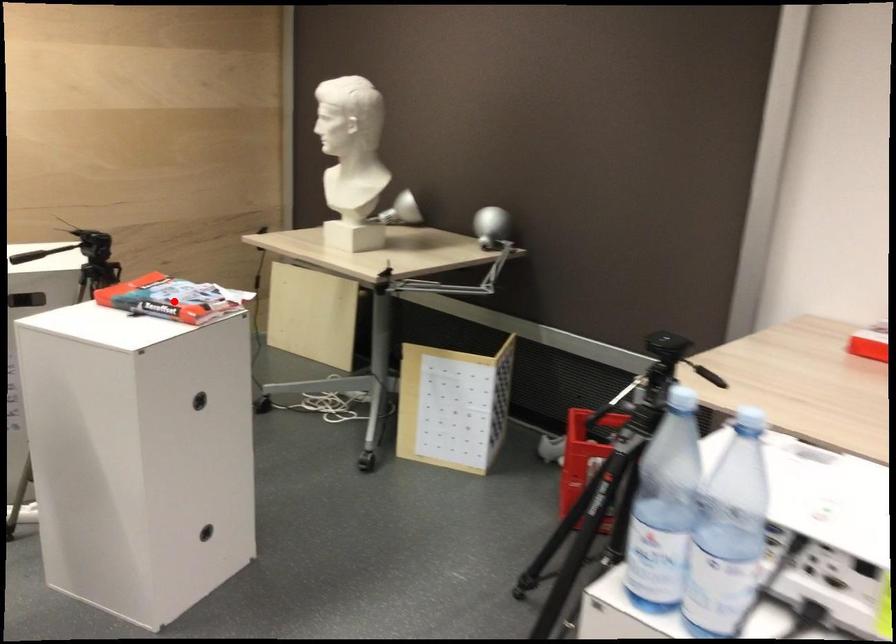
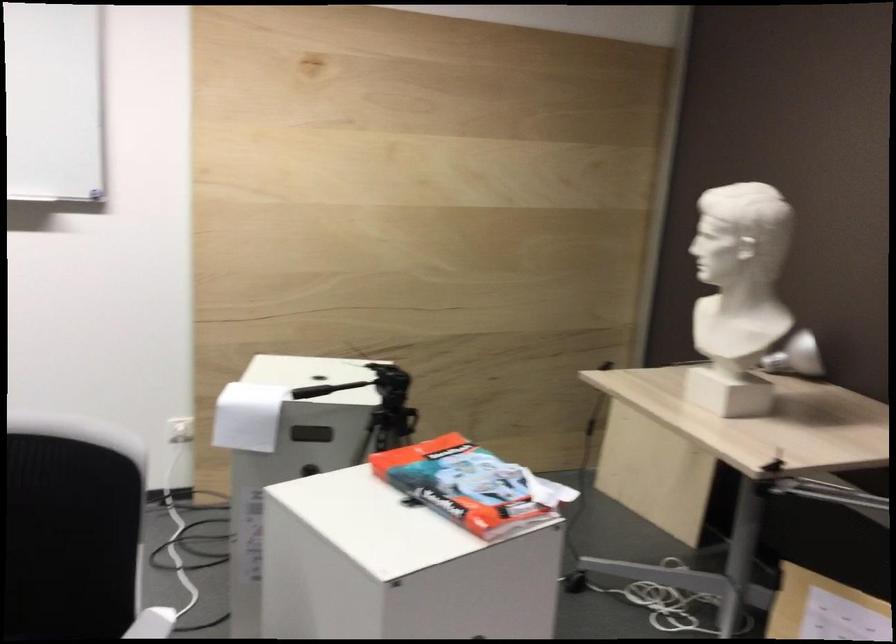
The point at the highlighted location is marked in the first image. Where is the corresponding point in the second image?

(462, 485)